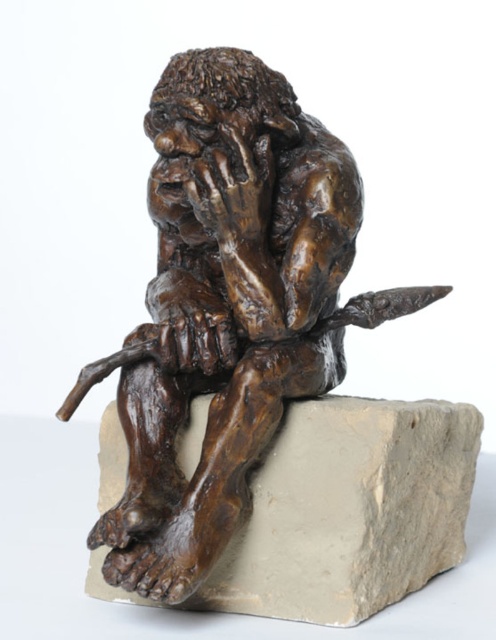
Is point (147, 328) in front of point (406, 589)?

Yes.

Can you confirm if bronze statue at center is positioned to the left of gray stone at center?

Indeed, bronze statue at center is positioned on the left side of gray stone at center.

Does point (191, 188) lie in front of point (364, 490)?

That is True.

Where is `bronze statue at center`? This screenshot has height=640, width=496. bronze statue at center is located at coordinates (228, 307).